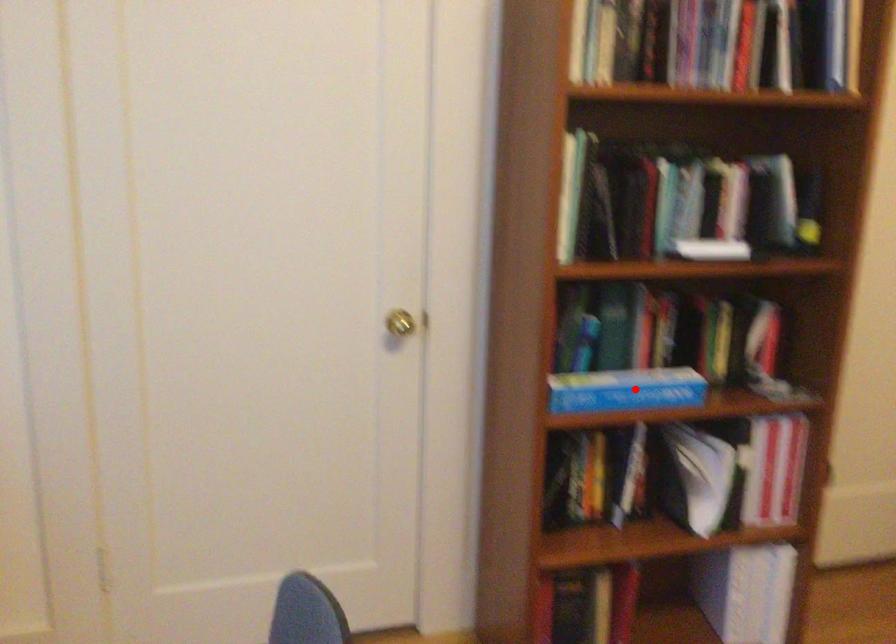
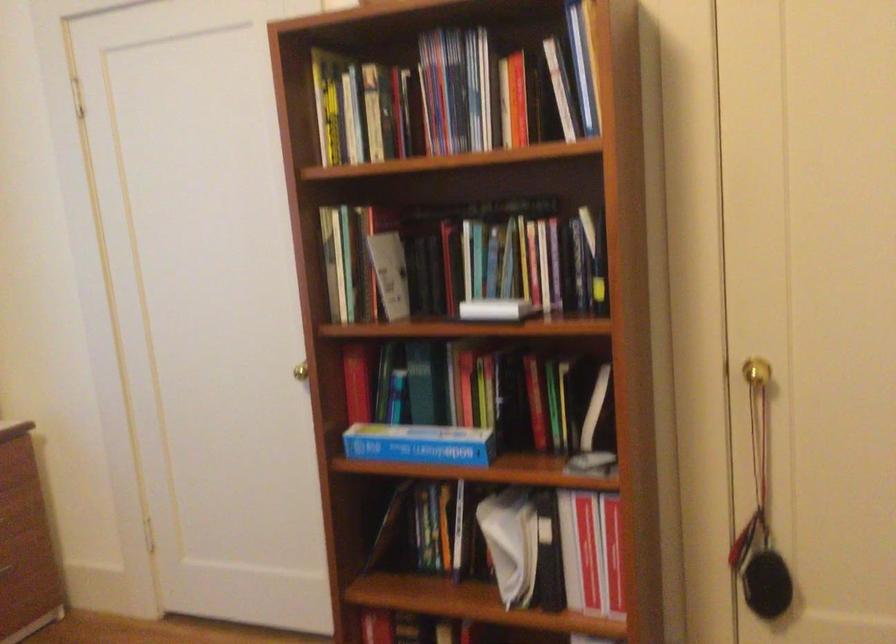
The point at the highlighted location is marked in the first image. Where is the corresponding point in the second image?

(419, 444)